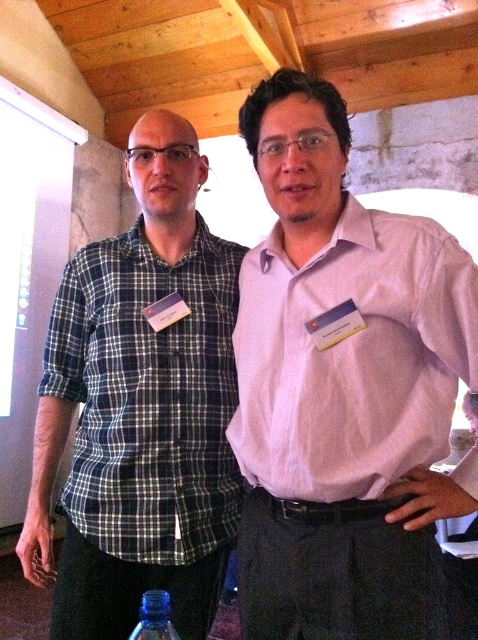
Can you confirm if pink smooth shirt at center is thinner than transparent plastic bottle at lower center?

In fact, pink smooth shirt at center might be wider than transparent plastic bottle at lower center.

Between pink smooth shirt at center and transparent plastic bottle at lower center, which one appears on the right side from the viewer's perspective?

Positioned to the right is pink smooth shirt at center.

Does point (436, 308) come behind point (162, 593)?

Yes, it is.

At what (x,y) coordinates should I click in order to perform the action: click on pink smooth shirt at center. Please return your answer as a coordinate pair (x, y). The image size is (478, 640). Looking at the image, I should click on (343, 388).

Describe the element at coordinates (343, 388) in the screenshot. I see `pink smooth shirt at center` at that location.

Is pink smooth shirt at center positioned at the back of plaid cotton shirt at left?

No, pink smooth shirt at center is in front of plaid cotton shirt at left.

Find the location of a particular element. This screenshot has height=640, width=478. pink smooth shirt at center is located at coordinates (343, 388).

Where is `pink smooth shirt at center`? pink smooth shirt at center is located at coordinates (343, 388).

The height and width of the screenshot is (640, 478). Describe the element at coordinates (141, 408) in the screenshot. I see `plaid cotton shirt at left` at that location.

Does point (196, 144) lie behind point (164, 637)?

Yes, point (196, 144) is farther from viewer.

Is point (214, 349) in front of point (142, 600)?

That is False.

Image resolution: width=478 pixels, height=640 pixels. I want to click on plaid cotton shirt at left, so [x=141, y=408].